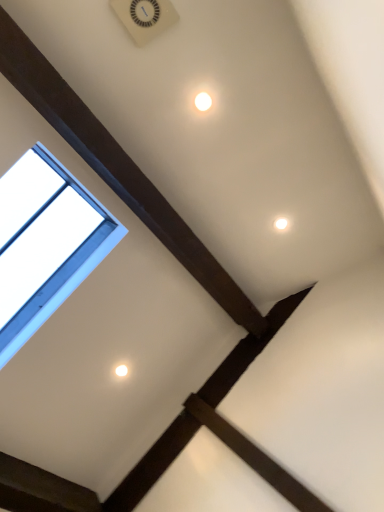
Question: Is white glossy light at upper center to the left or to the right of transparent glass window at upper left in the image?

Choices:
 (A) left
 (B) right

Answer: (B)

Question: From a real-world perspective, is white glossy light at upper center positioned above or below transparent glass window at upper left?

Choices:
 (A) above
 (B) below

Answer: (A)

Question: Based on their sizes in the image, would you say white glossy light at upper center is bigger or smaller than transparent glass window at upper left?

Choices:
 (A) small
 (B) big

Answer: (A)

Question: Is transparent glass window at upper left wider or thinner than white glossy light at upper center?

Choices:
 (A) wide
 (B) thin

Answer: (A)

Question: From a real-world perspective, is transparent glass window at upper left above or below white glossy light at upper center?

Choices:
 (A) below
 (B) above

Answer: (A)

Question: Is transparent glass window at upper left taller or shorter than white glossy light at upper center?

Choices:
 (A) tall
 (B) short

Answer: (A)

Question: Visually, is transparent glass window at upper left positioned to the left or to the right of white glossy light at upper center?

Choices:
 (A) right
 (B) left

Answer: (B)